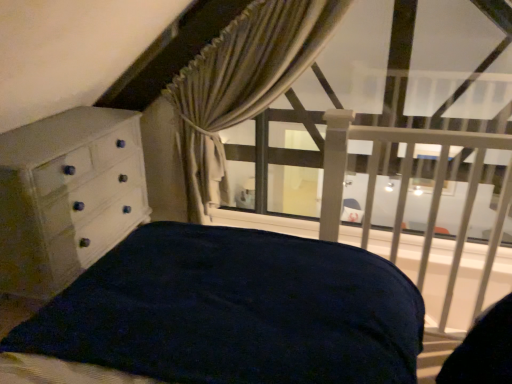
Question: Can you confirm if white painted wood chest of drawers at left is taller than white matte balustrade at upper right?

Choices:
 (A) no
 (B) yes

Answer: (A)

Question: From a real-world perspective, does white painted wood chest of drawers at left sit lower than white matte balustrade at upper right?

Choices:
 (A) no
 (B) yes

Answer: (B)

Question: Is white painted wood chest of drawers at left outside of white matte balustrade at upper right?

Choices:
 (A) yes
 (B) no

Answer: (A)

Question: Does white painted wood chest of drawers at left turn towards white matte balustrade at upper right?

Choices:
 (A) no
 (B) yes

Answer: (B)

Question: Can you confirm if white painted wood chest of drawers at left is smaller than white matte balustrade at upper right?

Choices:
 (A) no
 (B) yes

Answer: (A)

Question: From the image's perspective, relative to beige textured curtain at upper center, is white painted wood chest of drawers at left above or below?

Choices:
 (A) above
 (B) below

Answer: (B)

Question: Is white painted wood chest of drawers at left in front of or behind beige textured curtain at upper center in the image?

Choices:
 (A) behind
 (B) front

Answer: (B)

Question: Is point (135, 125) closer or farther from the camera than point (186, 172)?

Choices:
 (A) closer
 (B) farther

Answer: (A)

Question: Is white painted wood chest of drawers at left inside the boundaries of beige textured curtain at upper center, or outside?

Choices:
 (A) outside
 (B) inside

Answer: (A)

Question: Is white matte balustrade at upper right in front of or behind beige textured curtain at upper center in the image?

Choices:
 (A) behind
 (B) front

Answer: (B)

Question: In terms of size, does white matte balustrade at upper right appear bigger or smaller than beige textured curtain at upper center?

Choices:
 (A) big
 (B) small

Answer: (B)

Question: Does point (461, 223) appear closer or farther from the camera than point (202, 115)?

Choices:
 (A) closer
 (B) farther

Answer: (A)

Question: Is white matte balustrade at upper right inside or outside of beige textured curtain at upper center?

Choices:
 (A) inside
 (B) outside

Answer: (B)

Question: From their relative heights in the image, would you say beige textured curtain at upper center is taller or shorter than white painted wood chest of drawers at left?

Choices:
 (A) tall
 (B) short

Answer: (A)

Question: From the image's perspective, is beige textured curtain at upper center located above or below white painted wood chest of drawers at left?

Choices:
 (A) above
 (B) below

Answer: (A)